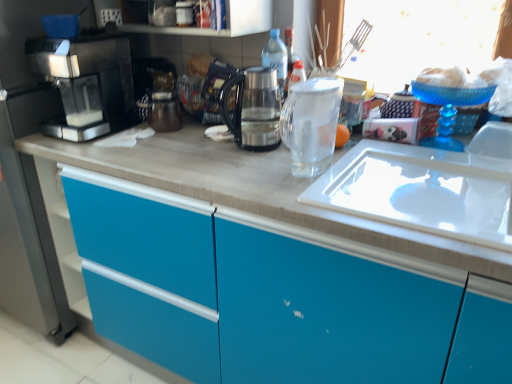
Image resolution: width=512 pixels, height=384 pixels. In order to click on free spot to the right of sleek black coffee machine at left in this screenshot , I will do `click(166, 144)`.